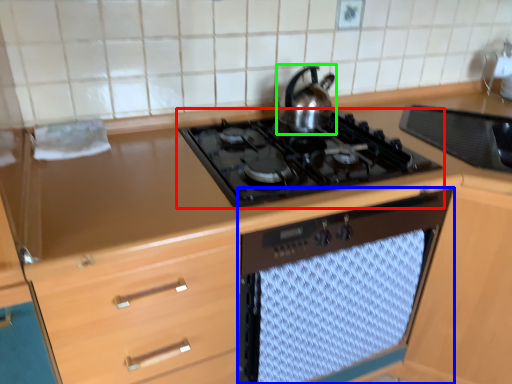
Question: Based on their relative distances, which object is nearer to gas stove (highlighted by a red box)? Choose from oven (highlighted by a blue box) and kitchen appliance (highlighted by a green box).

Choices:
 (A) oven
 (B) kitchen appliance

Answer: (B)